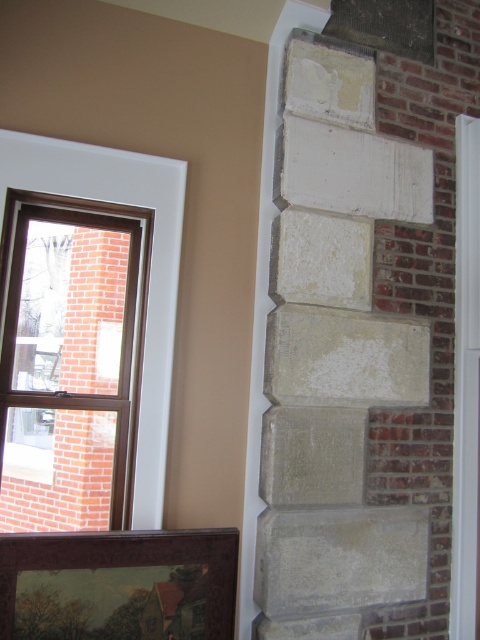
You are an interior designer assessing a wall with a white stone carving at center and a brown wooden picture frame at lower left. Which object would require a taller hanging hook to accommodate its height?

The white stone carving at center requires a taller hanging hook because it is much taller than the brown wooden picture frame at lower left.

You are an interior designer planning to hang a picture frame that is 30 cm wide. You want to place it near the white stone carving at center. Where should you place the picture frame to ensure it doesn not block the carving?

Place the picture frame to the left or right of the white stone carving at center to avoid blocking it, since the carving is located at the center point.

You are an interior designer planning to hang a new painting that is 20 inches wide. You have two options for placement near the clear glass window at upper left and the brown wooden picture frame at lower left. Can the painting fit between them without overlapping either object?

The clear glass window at upper left and brown wooden picture frame at lower left are 21.85 inches apart. Since the painting is 20 inches wide, it can fit between them as there is enough space.